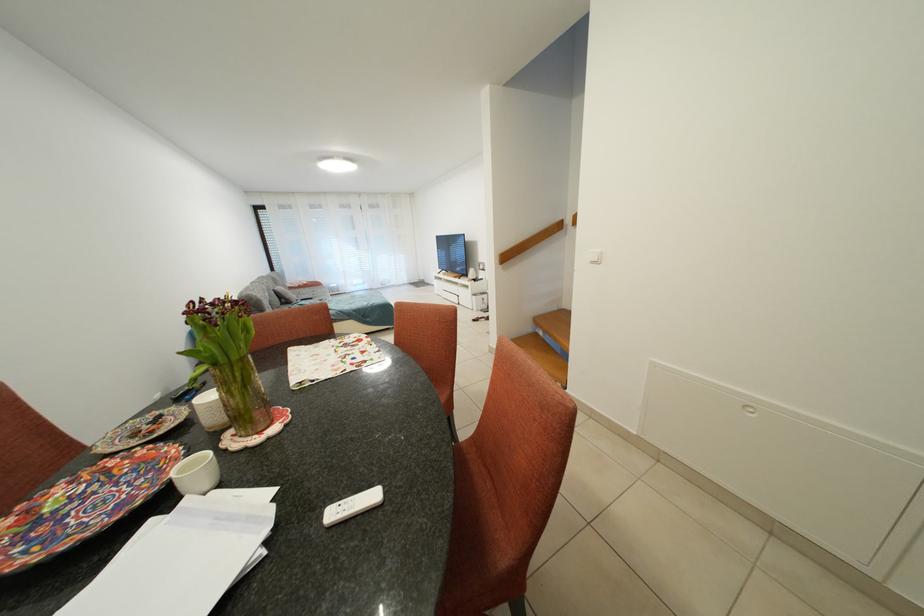
Where would you grasp the wooden stair handrail? Please return your answer as a coordinate pair (x, y).

(529, 241)